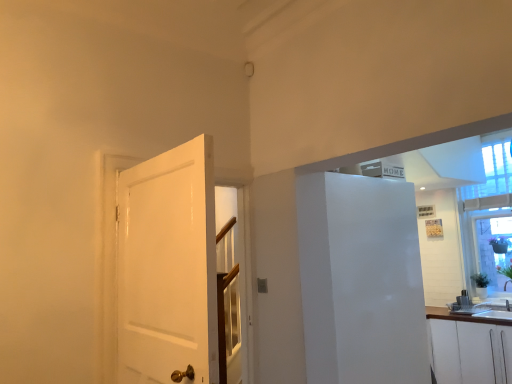
In order to click on white glossy door at left in this screenshot , I will do `click(168, 268)`.

What do you see at coordinates (168, 268) in the screenshot?
I see `white glossy door at left` at bounding box center [168, 268].

Identify the location of white matte cabinet at lower right. The image size is (512, 384). (468, 348).

Find the location of a particular element. This screenshot has width=512, height=384. white glossy refrigerator at right is located at coordinates (361, 280).

Considering the relative sizes of white glossy door at left and white matte cabinet at lower right in the image provided, is white glossy door at left thinner than white matte cabinet at lower right?

Yes.

Considering the relative positions of white glossy door at left and white matte cabinet at lower right in the image provided, is white glossy door at left behind white matte cabinet at lower right?

No, white glossy door at left is in front of white matte cabinet at lower right.

Locate an element on the screen. Image resolution: width=512 pixels, height=384 pixels. cabinetry below the white glossy door at left (from a real-world perspective) is located at coordinates (468, 348).

From a real-world perspective, is white glossy door at left positioned above or below white matte cabinet at lower right?

Clearly, from a real-world perspective, white glossy door at left is above white matte cabinet at lower right.

Identify the location of cabinetry on the right of white glossy door at left. (468, 348).

Is white matte cabinet at lower right next to white glossy door at left?

No.

In the image, is white matte cabinet at lower right on the left side or the right side of white glossy door at left?

From the image, it's evident that white matte cabinet at lower right is to the right of white glossy door at left.

Based on the photo, can you confirm if white matte cabinet at lower right is shorter than white glossy door at left?

Yes.

Is white matte cabinet at lower right spatially inside transparent glass window at upper right, or outside of it?

white matte cabinet at lower right is spatially situated outside transparent glass window at upper right.

Considering the relative positions of white matte cabinet at lower right and transparent glass window at upper right in the image provided, is white matte cabinet at lower right in front of transparent glass window at upper right?

Yes, the depth of white matte cabinet at lower right is less than that of transparent glass window at upper right.

Who is shorter, white matte cabinet at lower right or transparent glass window at upper right?

white matte cabinet at lower right is shorter.

How many degrees apart are the facing directions of white matte cabinet at lower right and transparent glass window at upper right?

There is a 1.42-degree angle between the facing directions of white matte cabinet at lower right and transparent glass window at upper right.

The width and height of the screenshot is (512, 384). In order to click on window that is above the white glossy door at left (from a real-world perspective) in this screenshot , I will do `click(488, 215)`.

Would you say white glossy door at left contains transparent glass window at upper right?

No.

Is white glossy door at left smaller than transparent glass window at upper right?

Indeed, white glossy door at left has a smaller size compared to transparent glass window at upper right.

Based on the photo, considering the sizes of objects white glossy door at left and white glossy refrigerator at right in the image provided, who is wider, white glossy door at left or white glossy refrigerator at right?

white glossy refrigerator at right.

Is point (121, 200) farther from viewer compared to point (398, 351)?

No, it is not.

Which is more to the right, white glossy door at left or white glossy refrigerator at right?

From the viewer's perspective, white glossy refrigerator at right appears more on the right side.

Is transparent glass window at upper right aimed at white matte cabinet at lower right?

No, transparent glass window at upper right is not oriented towards white matte cabinet at lower right.

From the image's perspective, which one is positioned lower, transparent glass window at upper right or white matte cabinet at lower right?

From the image's view, white matte cabinet at lower right is below.

Does transparent glass window at upper right have a larger size compared to white matte cabinet at lower right?

Actually, transparent glass window at upper right might be smaller than white matte cabinet at lower right.

How different are the orientations of transparent glass window at upper right and white matte cabinet at lower right in degrees?

1.42 degrees separate the facing orientations of transparent glass window at upper right and white matte cabinet at lower right.

Looking at this image, between white glossy refrigerator at right and white matte cabinet at lower right, which one has smaller width?

white glossy refrigerator at right.

Considering the sizes of objects white glossy refrigerator at right and white matte cabinet at lower right in the image provided, who is taller, white glossy refrigerator at right or white matte cabinet at lower right?

white glossy refrigerator at right is taller.

In the image, is white glossy refrigerator at right positioned in front of or behind white matte cabinet at lower right?

Clearly, white glossy refrigerator at right is in front of white matte cabinet at lower right.

Find the location of `elevator in front of the white matte cabinet at lower right`. elevator in front of the white matte cabinet at lower right is located at coordinates (361, 280).

The height and width of the screenshot is (384, 512). I want to click on cabinetry that appears below the white glossy door at left (from the image's perspective), so click(x=468, y=348).

Find the location of `door on the left of white matte cabinet at lower right`. door on the left of white matte cabinet at lower right is located at coordinates pyautogui.click(x=168, y=268).

When comparing their distances from white glossy door at left, does white glossy refrigerator at right or transparent glass window at upper right seem further?

Based on the image, transparent glass window at upper right appears to be further to white glossy door at left.

Estimate the real-world distances between objects in this image. Which object is closer to white matte cabinet at lower right, white glossy refrigerator at right or transparent glass window at upper right?

transparent glass window at upper right is positioned closer to the anchor white matte cabinet at lower right.

From the image, which object appears to be nearer to transparent glass window at upper right, white matte cabinet at lower right or white glossy refrigerator at right?

white matte cabinet at lower right.

Considering their positions, is white matte cabinet at lower right positioned further to white glossy door at left than transparent glass window at upper right?

Among the two, transparent glass window at upper right is located further to white glossy door at left.

Based on their spatial positions, is white matte cabinet at lower right or transparent glass window at upper right further from white glossy refrigerator at right?

Among the two, transparent glass window at upper right is located further to white glossy refrigerator at right.

Estimate the real-world distances between objects in this image. Which object is further from transparent glass window at upper right, white matte cabinet at lower right or white glossy door at left?

Among the two, white glossy door at left is located further to transparent glass window at upper right.

Looking at the image, which one is located closer to transparent glass window at upper right, white glossy door at left or white matte cabinet at lower right?

white matte cabinet at lower right lies closer to transparent glass window at upper right than the other object.

Looking at the image, which one is located further to white matte cabinet at lower right, white glossy door at left or transparent glass window at upper right?

The object further to white matte cabinet at lower right is white glossy door at left.

Where is `cabinetry located between white glossy refrigerator at right and transparent glass window at upper right in the left-right direction`? This screenshot has height=384, width=512. cabinetry located between white glossy refrigerator at right and transparent glass window at upper right in the left-right direction is located at coordinates (468, 348).

Locate an element on the screen. The image size is (512, 384). cabinetry located between white glossy door at left and transparent glass window at upper right in the left-right direction is located at coordinates (468, 348).

At what (x,y) coordinates should I click in order to perform the action: click on elevator between white glossy door at left and white matte cabinet at lower right in the horizontal direction. Please return your answer as a coordinate pair (x, y). Looking at the image, I should click on (361, 280).

Locate an element on the screen. The image size is (512, 384). elevator between white glossy door at left and transparent glass window at upper right in the horizontal direction is located at coordinates (361, 280).